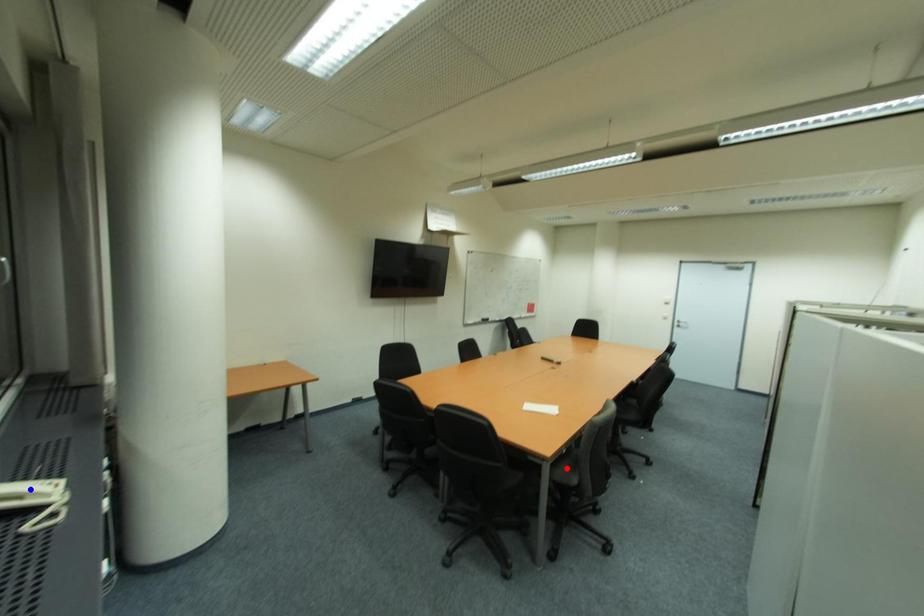
Question: Which of the two points in the image is closer to the camera?

Choices:
 (A) Blue point is closer.
 (B) Red point is closer.

Answer: (A)